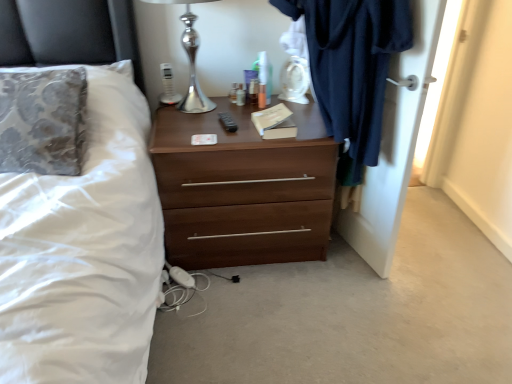
Where is `silver metallic table lamp at upper center`? The width and height of the screenshot is (512, 384). silver metallic table lamp at upper center is located at coordinates (190, 59).

At what (x,y) coordinates should I click in order to perform the action: click on brown wood chest of drawers at center. Please return your answer as a coordinate pair (x, y). The height and width of the screenshot is (384, 512). Looking at the image, I should click on (243, 189).

Considering the sizes of dark blue fabric at right and silver metallic table lamp at upper center in the image, is dark blue fabric at right wider or thinner than silver metallic table lamp at upper center?

Clearly, dark blue fabric at right has more width compared to silver metallic table lamp at upper center.

Is dark blue fabric at right situated inside silver metallic table lamp at upper center or outside?

dark blue fabric at right is outside silver metallic table lamp at upper center.

Based on their sizes in the image, would you say dark blue fabric at right is bigger or smaller than silver metallic table lamp at upper center?

In the image, dark blue fabric at right appears to be larger than silver metallic table lamp at upper center.

Which object is positioned more to the left, dark blue fabric at right or silver metallic table lamp at upper center?

Positioned to the left is silver metallic table lamp at upper center.

Considering the positions of points (126, 178) and (181, 109), is point (126, 178) closer to camera compared to point (181, 109)?

Yes.

Is white fabric bed at left bigger than silver metallic table lamp at upper center?

Yes, white fabric bed at left is bigger than silver metallic table lamp at upper center.

Based on their positions, is white fabric bed at left located to the left or right of silver metallic table lamp at upper center?

white fabric bed at left is positioned on silver metallic table lamp at upper center's left side.

I want to click on table lamp on the right of white fabric bed at left, so click(190, 59).

Can we say brown wood chest of drawers at center lies outside silver metallic table lamp at upper center?

Absolutely, brown wood chest of drawers at center is external to silver metallic table lamp at upper center.

How different are the orientations of brown wood chest of drawers at center and silver metallic table lamp at upper center in degrees?

0.00107 degrees.

Is brown wood chest of drawers at center in front of silver metallic table lamp at upper center?

That is False.

From a real-world perspective, is brown wood chest of drawers at center above or below silver metallic table lamp at upper center?

From a real-world perspective, brown wood chest of drawers at center is physically below silver metallic table lamp at upper center.

Is silver metallic table lamp at upper center outside of dark blue fabric at right?

Yes, silver metallic table lamp at upper center is not within dark blue fabric at right.

Does silver metallic table lamp at upper center have a lesser width compared to dark blue fabric at right?

In fact, silver metallic table lamp at upper center might be wider than dark blue fabric at right.

What's the angular difference between silver metallic table lamp at upper center and dark blue fabric at right's facing directions?

104 degrees separate the facing orientations of silver metallic table lamp at upper center and dark blue fabric at right.

Is silver metallic table lamp at upper center not close to dark blue fabric at right?

No, silver metallic table lamp at upper center is not far from dark blue fabric at right.

Is brown wood chest of drawers at center bigger or smaller than dark blue fabric at right?

Clearly, brown wood chest of drawers at center is larger in size than dark blue fabric at right.

Which is more distant, (220, 226) or (422, 29)?

The point (220, 226) is farther.

Who is more distant, brown wood chest of drawers at center or dark blue fabric at right?

brown wood chest of drawers at center is further away from the camera.

Is brown wood chest of drawers at center with dark blue fabric at right?

No, brown wood chest of drawers at center is not in contact with dark blue fabric at right.

Would you say dark blue fabric at right contains white fabric bed at left?

No, white fabric bed at left is not a part of dark blue fabric at right.

Which object is thinner, dark blue fabric at right or white fabric bed at left?

dark blue fabric at right.

Is dark blue fabric at right facing away from white fabric bed at left?

No, white fabric bed at left is not at the back of dark blue fabric at right.

From a real-world perspective, is dark blue fabric at right positioned over white fabric bed at left based on gravity?

No, from a real-world perspective, dark blue fabric at right is not above white fabric bed at left.

Considering the sizes of white fabric bed at left and dark blue fabric at right in the image, is white fabric bed at left wider or thinner than dark blue fabric at right?

In the image, white fabric bed at left appears to be wider than dark blue fabric at right.

Which is in front, point (128, 60) or point (418, 45)?

The point (418, 45) is in front.

Does white fabric bed at left have a lesser height compared to dark blue fabric at right?

Yes, white fabric bed at left is shorter than dark blue fabric at right.

Does white fabric bed at left turn towards dark blue fabric at right?

No, white fabric bed at left is not oriented towards dark blue fabric at right.

At what (x,y) coordinates should I click in order to perform the action: click on table lamp lying on the left of dark blue fabric at right. Please return your answer as a coordinate pair (x, y). Looking at the image, I should click on (190, 59).

Where is `table lamp on the right of white fabric bed at left`? The height and width of the screenshot is (384, 512). table lamp on the right of white fabric bed at left is located at coordinates (190, 59).

Which object lies further to the anchor point brown wood chest of drawers at center, white fabric bed at left or dark blue fabric at right?

white fabric bed at left is positioned further to the anchor brown wood chest of drawers at center.

Considering their positions, is silver metallic table lamp at upper center positioned further to white fabric bed at left than dark blue fabric at right?

Among the two, dark blue fabric at right is located further to white fabric bed at left.

Which object lies nearer to the anchor point white fabric bed at left, dark blue fabric at right or silver metallic table lamp at upper center?

The object closer to white fabric bed at left is silver metallic table lamp at upper center.

Based on their spatial positions, is white fabric bed at left or silver metallic table lamp at upper center further from dark blue fabric at right?

white fabric bed at left is positioned further to the anchor dark blue fabric at right.

Looking at the image, which one is located further to dark blue fabric at right, brown wood chest of drawers at center or silver metallic table lamp at upper center?

Based on the image, silver metallic table lamp at upper center appears to be further to dark blue fabric at right.

Estimate the real-world distances between objects in this image. Which object is further from dark blue fabric at right, brown wood chest of drawers at center or silver metallic table lamp at upper center?

silver metallic table lamp at upper center.

Based on their spatial positions, is dark blue fabric at right or dark blue fabric at right closer to brown wood chest of drawers at center?

dark blue fabric at right is positioned closer to the anchor brown wood chest of drawers at center.

Looking at the image, which one is located further to silver metallic table lamp at upper center, brown wood chest of drawers at center or dark blue fabric at right?

dark blue fabric at right is further to silver metallic table lamp at upper center.

You are a GUI agent. You are given a task and a screenshot of the screen. Output one action in this format:
    pyautogui.click(x=<x>, y=<y>)
    Task: Click on the table lamp between white fabric bed at left and dark blue fabric at right
    The width and height of the screenshot is (512, 384).
    Given the screenshot: What is the action you would take?
    pyautogui.click(x=190, y=59)

I want to click on table lamp situated between white fabric bed at left and dark blue fabric at right from left to right, so click(190, 59).

Identify the location of chest of drawers between white fabric bed at left and dark blue fabric at right from left to right. (243, 189).

Image resolution: width=512 pixels, height=384 pixels. I want to click on clothing that lies between silver metallic table lamp at upper center and brown wood chest of drawers at center from top to bottom, so click(x=352, y=69).